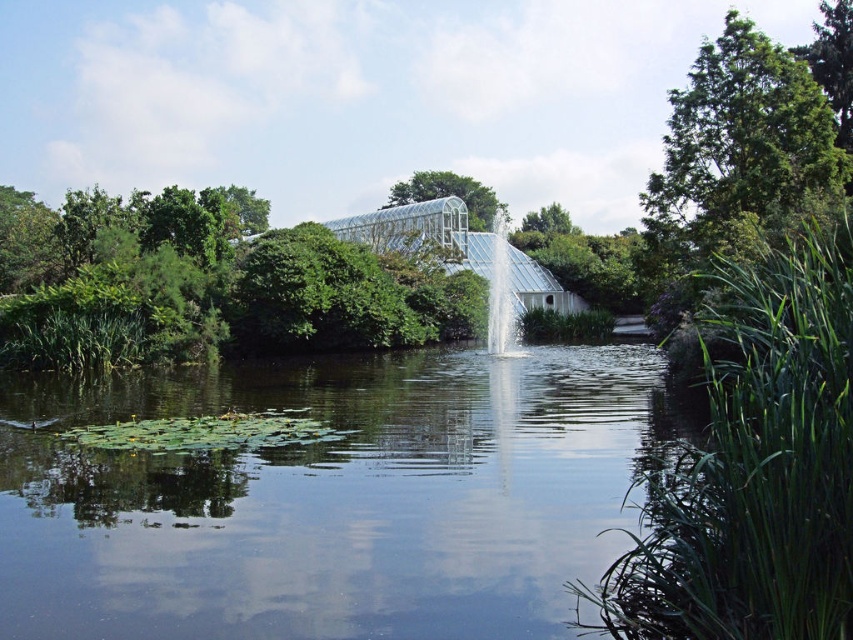
You are a gardener who wants to plant a new flower bed between the clear water at center and the green glass greenhouse at upper center. Which object should you start working closer to?

The clear water at center is shorter than the green glass greenhouse at upper center, so you should start working closer to the clear water at center because it is lower in height.

You are standing in the serene outdoor scene and want to place a small decorative stone. You have two points to choose from, point 1 at point (733, 451) and point 2 at point (740, 161). Which point is closer to you where you can place the stone more easily?

Point (733, 451) is closer to the viewer than point (740, 161), so placing the stone there would be easier.

Looking at this image, you are standing at the center of the pond and want to take a photo of both point (585, 388) and point (491, 212). Which point will appear larger in your photo?

Point (585, 388) will appear larger in the photo because it is closer to the camera than point (491, 212).